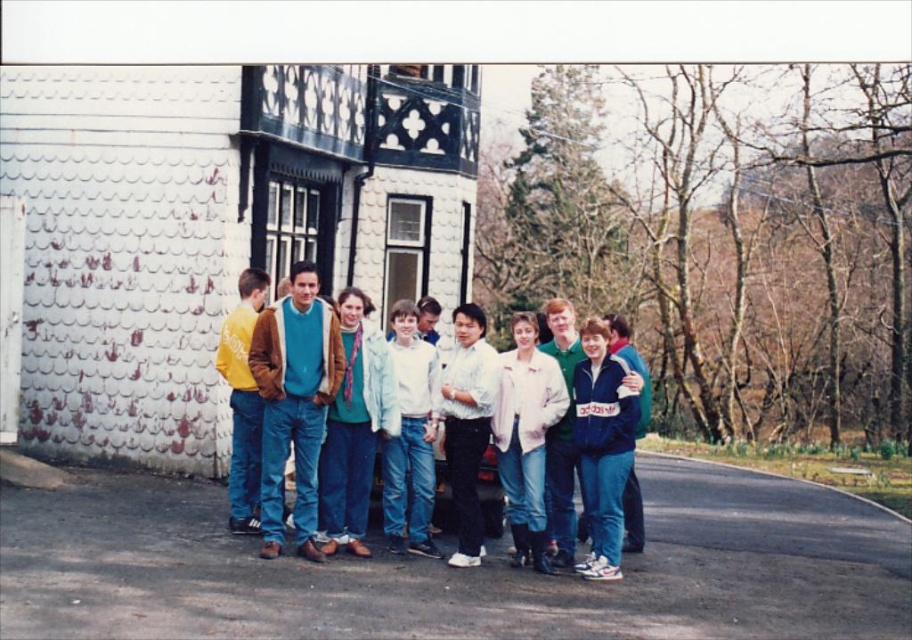
Question: Is matte brown jacket at center positioned before white matte jacket at center?

Choices:
 (A) no
 (B) yes

Answer: (B)

Question: Can you confirm if matte brown jacket at center is wider than light pink fabric jacket at center?

Choices:
 (A) no
 (B) yes

Answer: (B)

Question: Is matte brown jacket at center below green matte shirt at center?

Choices:
 (A) yes
 (B) no

Answer: (B)

Question: Which object is farther from the camera taking this photo?

Choices:
 (A) yellow matte jacket at left
 (B) white matte shirt at center
 (C) matte blue jeans at center

Answer: (A)

Question: Which object is farther from the camera taking this photo?

Choices:
 (A) blue fleece jacket at center
 (B) green matte shirt at center
 (C) yellow matte jacket at left
 (D) light pink fabric jacket at center

Answer: (B)

Question: Among these objects, which one is farthest from the camera?

Choices:
 (A) matte brown jacket at center
 (B) white matte shirt at center
 (C) green matte shirt at center
 (D) yellow matte jacket at left

Answer: (C)